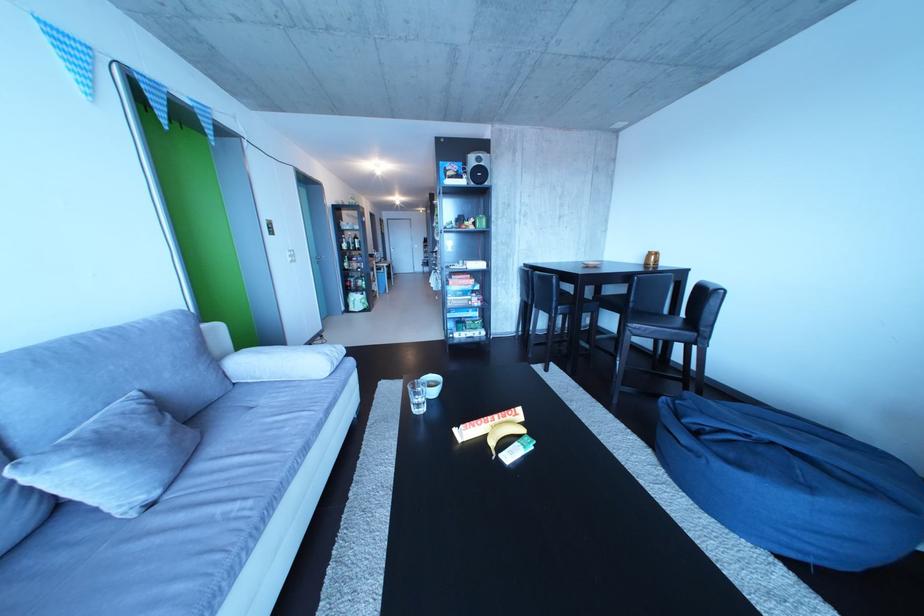
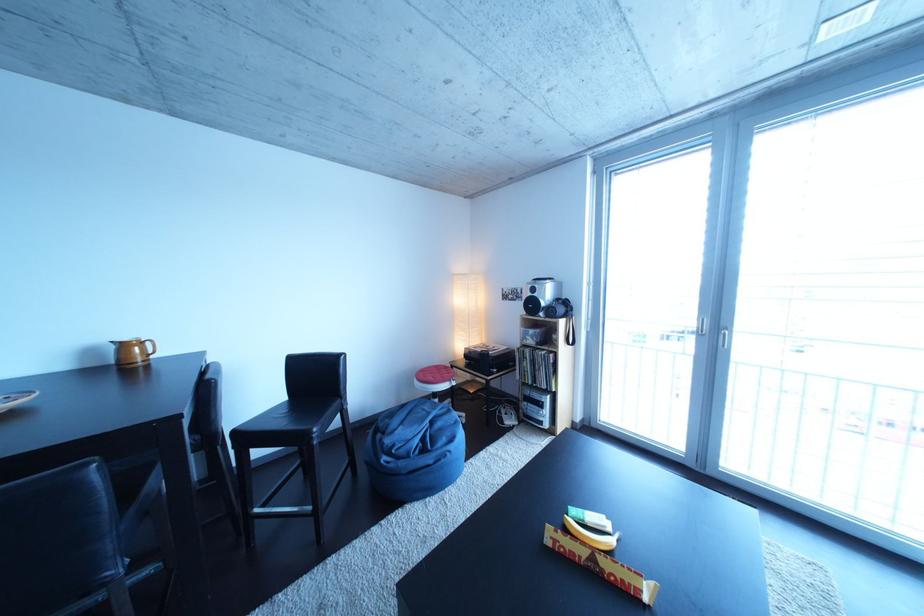
In the second image, find the point that corresponds to [784,448] in the first image.

(444, 428)